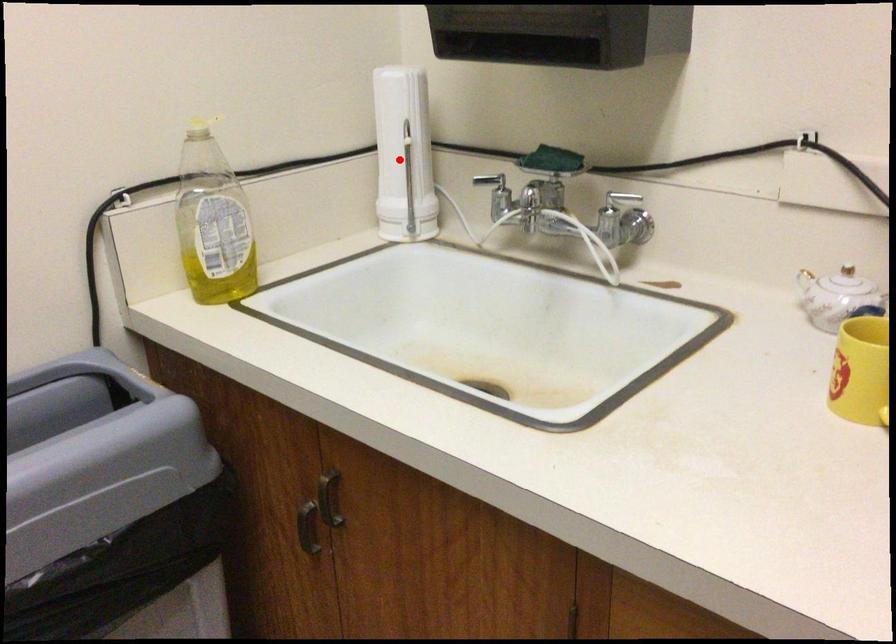
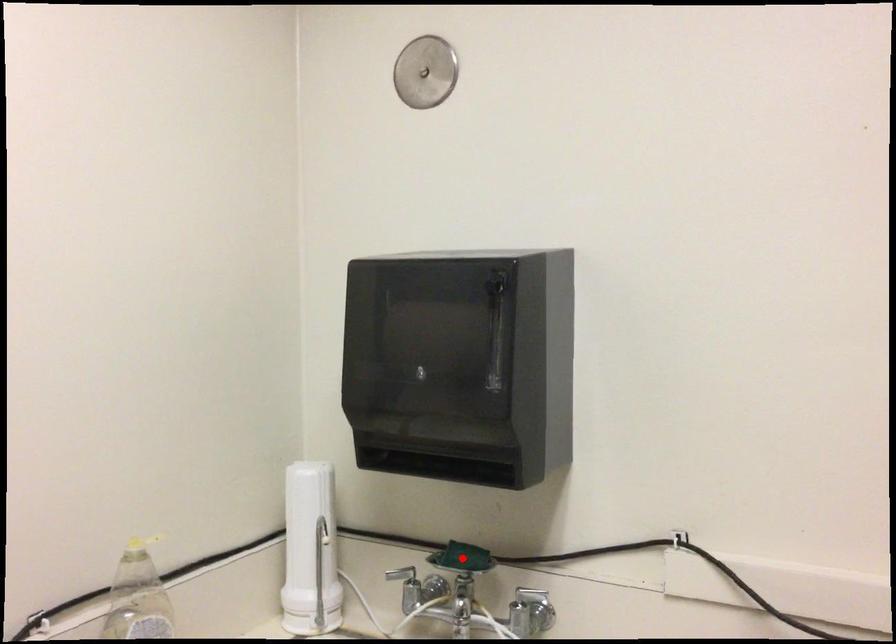
I am providing you with two images of the same scene from different viewpoints. A red point is marked on the first image and another point is marked on the second image. Are the points marked in image1 and image2 representing the same 3D position?

No